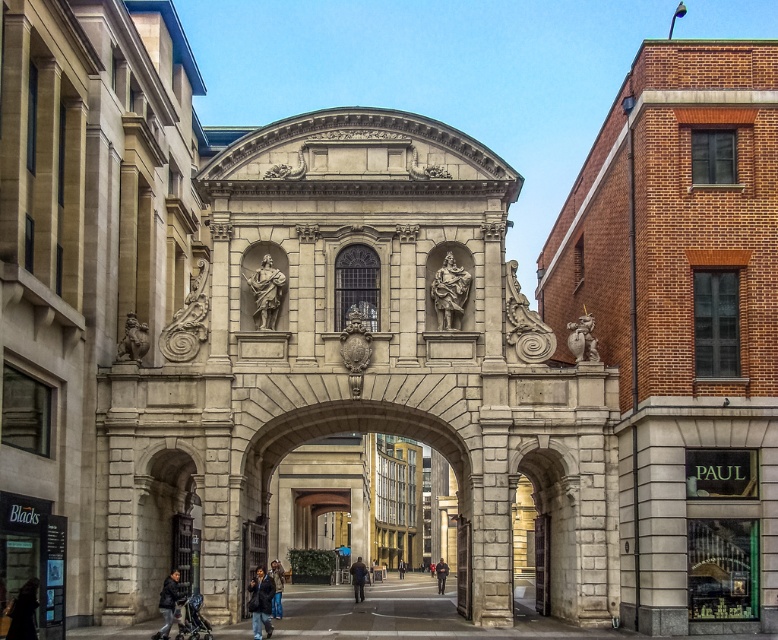
Is dark blue jacket at center to the left of dark gray jacket at center from the viewer's perspective?

Yes, dark blue jacket at center is to the left of dark gray jacket at center.

Can you confirm if dark blue jacket at center is wider than dark gray jacket at center?

Indeed, dark blue jacket at center has a greater width compared to dark gray jacket at center.

What do you see at coordinates (358, 579) in the screenshot? I see `dark blue jacket at center` at bounding box center [358, 579].

The image size is (778, 640). I want to click on dark blue jacket at center, so click(358, 579).

Between polished stone statue at center and dark gray suit at center, which one is positioned higher?

polished stone statue at center is higher up.

Measure the distance between point (454, 300) and camera.

Point (454, 300) and camera are 76.85 meters apart.

What do you see at coordinates (449, 292) in the screenshot? I see `polished stone statue at center` at bounding box center [449, 292].

Identify the location of polished stone statue at center. The width and height of the screenshot is (778, 640). (449, 292).

How much distance is there between dark gray coat at lower left and dark blue jacket at lower left?

dark gray coat at lower left and dark blue jacket at lower left are 9.36 meters apart.

Find the location of a particular element. This screenshot has height=640, width=778. dark gray coat at lower left is located at coordinates (23, 611).